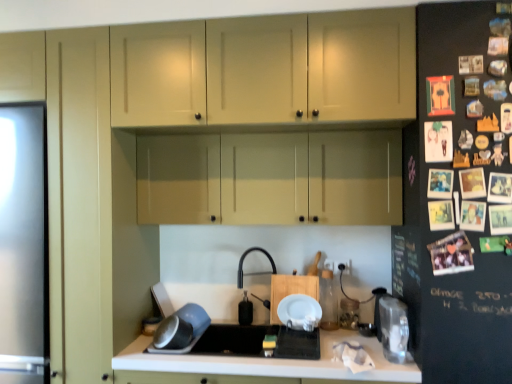
Question: Does metallic silver bowl at lower left, placed as the first appliance when sorted from left to right, appear on the left side of transparent plastic container at right, which is the third appliance from left to right?

Choices:
 (A) no
 (B) yes

Answer: (B)

Question: From a real-world perspective, is metallic silver bowl at lower left, placed as the first appliance when sorted from left to right, on top of transparent plastic container at right, the 1th appliance from the right?

Choices:
 (A) no
 (B) yes

Answer: (A)

Question: Is metallic silver bowl at lower left, placed as the first appliance when sorted from left to right, shorter than transparent plastic container at right, which is the third appliance from left to right?

Choices:
 (A) no
 (B) yes

Answer: (B)

Question: From a real-world perspective, is metallic silver bowl at lower left, which is the 3th appliance from right to left, positioned under transparent plastic container at right, which is the third appliance from left to right, based on gravity?

Choices:
 (A) yes
 (B) no

Answer: (A)

Question: Is metallic silver bowl at lower left, placed as the first appliance when sorted from left to right, closer to the viewer compared to transparent plastic container at right, the 1th appliance from the right?

Choices:
 (A) yes
 (B) no

Answer: (B)

Question: Is metallic silver bowl at lower left, which is the 3th appliance from right to left, wider than transparent plastic container at right, which is the third appliance from left to right?

Choices:
 (A) no
 (B) yes

Answer: (B)

Question: Is black matte sink at center not within transparent plastic container at right, which is the third appliance from left to right?

Choices:
 (A) no
 (B) yes

Answer: (B)

Question: Is the position of black matte sink at center more distant than that of transparent plastic container at right, which is the third appliance from left to right?

Choices:
 (A) yes
 (B) no

Answer: (A)

Question: From the image's perspective, is black matte sink at center below transparent plastic container at right, the 1th appliance from the right?

Choices:
 (A) yes
 (B) no

Answer: (A)

Question: Can you confirm if black matte sink at center is shorter than transparent plastic container at right, which is the third appliance from left to right?

Choices:
 (A) yes
 (B) no

Answer: (A)

Question: Is black matte sink at center far from transparent plastic container at right, which is the third appliance from left to right?

Choices:
 (A) no
 (B) yes

Answer: (A)

Question: From the image's perspective, is black matte sink at center on top of transparent plastic container at right, the 1th appliance from the right?

Choices:
 (A) yes
 (B) no

Answer: (B)

Question: Is white matte countertop at center thinner than black rubber faucet at center?

Choices:
 (A) no
 (B) yes

Answer: (A)